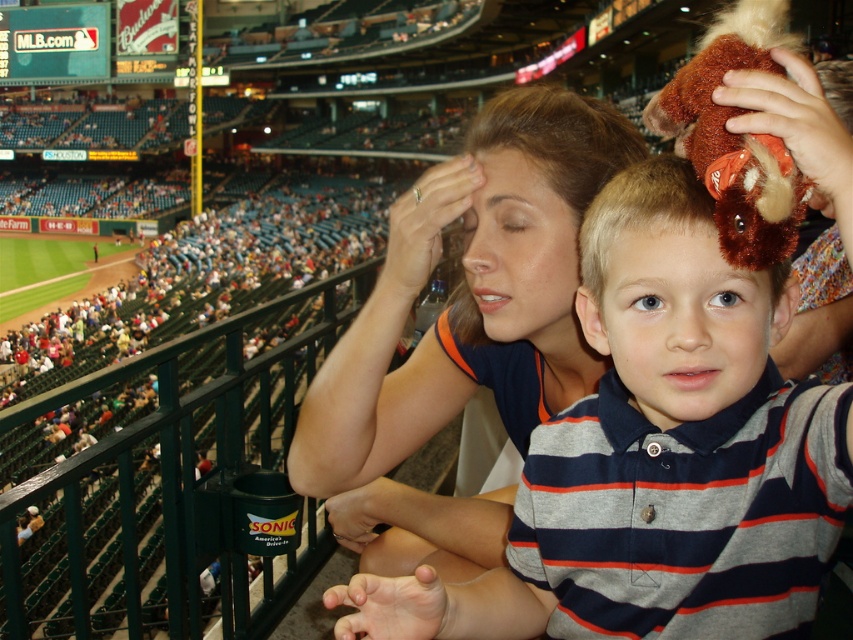
You are a photographer at the baseball stadium. You want to take a photo of the two subjects, the matte blue shirt at center and the brown plush toy at center, ensuring both are visible. Which subject should you position closer to the left side of the frame to include both in the shot?

The matte blue shirt at center is positioned on the left side of brown plush toy at center, so to include both in the shot, you should position the matte blue shirt at center closer to the left side of the frame.

Based on the scene description, where exactly is the matte blue shirt at center located in the image?

The matte blue shirt at center is located at point coordinates of 0.516 on the x axis and 0.545 on the y axis.

You are a photographer at the baseball stadium and want to capture a photo of the two people in the foreground. The matte blue shirt at center and the striped cotton shirt at center are in your viewfinder. Which shirt should you focus on to ensure the person wearing it is closer to the camera?

The matte blue shirt at center is above the striped cotton shirt at center, so focusing on the matte blue shirt at center will ensure the person wearing it is closer to the camera since it is positioned higher in the frame.